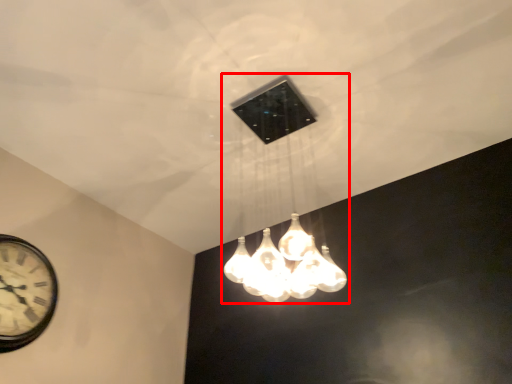
Question: From the image's perspective, considering the relative positions of lamp (annotated by the red box) and wall clock in the image provided, where is lamp (annotated by the red box) located with respect to the staircase?

Choices:
 (A) below
 (B) above

Answer: (B)